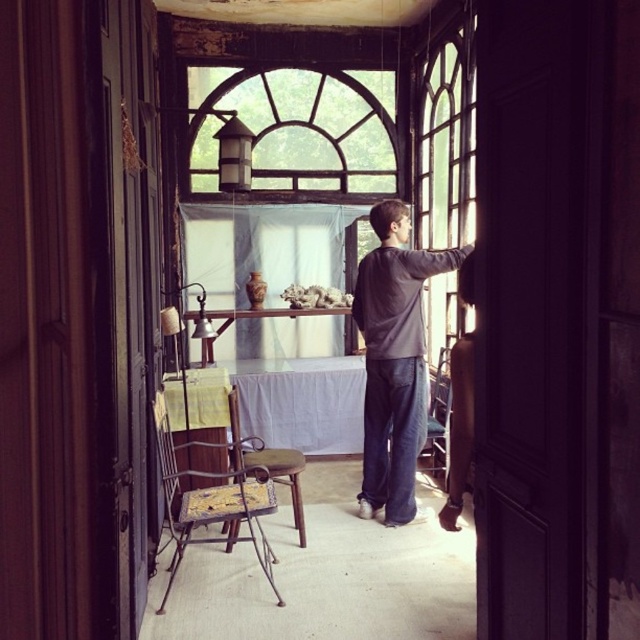
You are organizing a small gathering and need to place a 1.2 meter long centerpiece on the table. Given the white cloth at center and the metallic wire chair at center, which object can accommodate the length of the centerpiece without it hanging off the table?

The white cloth at center can accommodate the 1.2 meter long centerpiece since its width is larger than that of the metallic wire chair at center, indicating it has enough space to hold the centerpiece without it hanging off the table.

You are standing in the doorway of the sunroom. You see a point marked at coordinates (262,248). What object is located at that point?

The point at coordinates (262,248) marks the white sheer curtain at center.